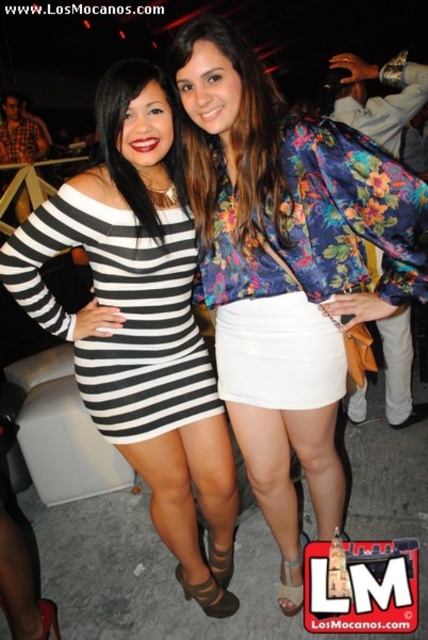
Question: Which point is farther to the camera?

Choices:
 (A) black and white striped dress at center
 (B) floral fabric blouse at center
 (C) floral satin blouse at center
 (D) black matte dress at center

Answer: (A)

Question: Is black and white striped dress at center in front of floral fabric blouse at center?

Choices:
 (A) yes
 (B) no

Answer: (B)

Question: Is the position of black matte dress at center less distant than that of floral fabric blouse at center?

Choices:
 (A) yes
 (B) no

Answer: (B)

Question: From the image, what is the correct spatial relationship of black matte dress at center in relation to floral fabric blouse at center?

Choices:
 (A) left
 (B) right

Answer: (A)

Question: Which point appears farthest from the camera in this image?

Choices:
 (A) (303, 209)
 (B) (118, 320)
 (C) (98, 372)

Answer: (C)

Question: Which object is closer to the camera taking this photo?

Choices:
 (A) floral fabric blouse at center
 (B) floral satin blouse at center
 (C) black and white striped dress at center

Answer: (B)